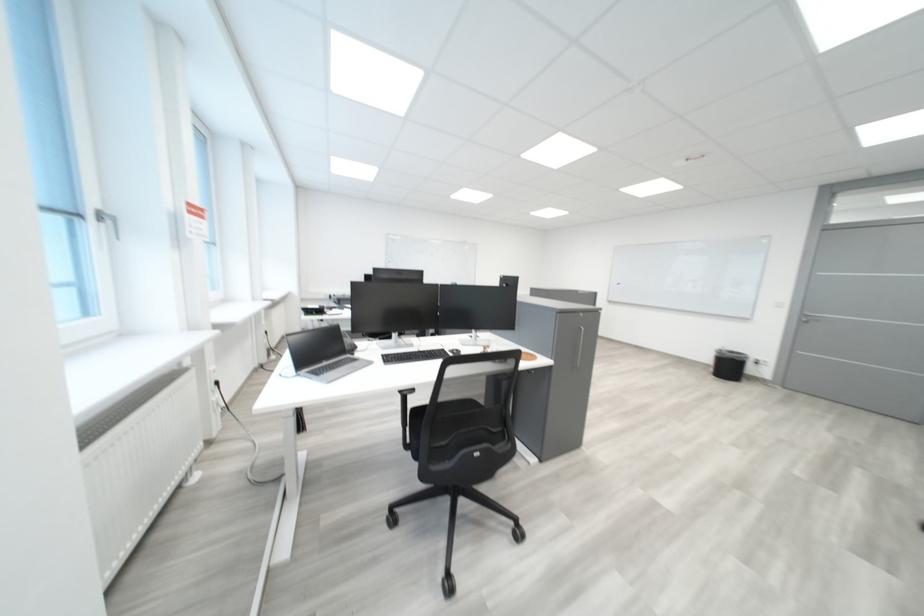
Find the location of a particular element. Image resolution: width=924 pixels, height=616 pixels. chair armrest is located at coordinates (406, 392).